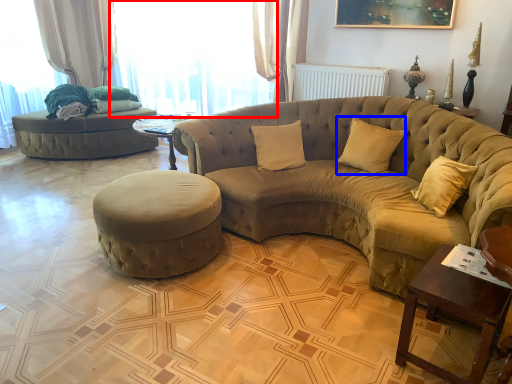
Question: Which of the following is the closest to the observer, window (highlighted by a red box) or pillow (highlighted by a blue box)?

Choices:
 (A) window
 (B) pillow

Answer: (B)